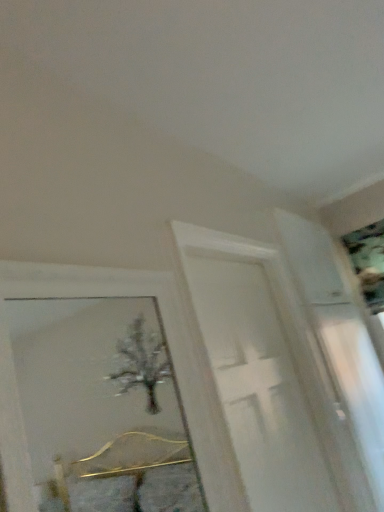
Question: Do you think white glossy screen door at center is within metallic silver picture frame at upper right, or outside of it?

Choices:
 (A) inside
 (B) outside

Answer: (B)

Question: Considering the positions of point (266, 440) and point (369, 240), is point (266, 440) closer or farther from the camera than point (369, 240)?

Choices:
 (A) closer
 (B) farther

Answer: (A)

Question: Based on their sizes in the image, would you say white glossy screen door at center is bigger or smaller than metallic silver picture frame at upper right?

Choices:
 (A) small
 (B) big

Answer: (B)

Question: Is metallic silver picture frame at upper right inside the boundaries of white glossy screen door at center, or outside?

Choices:
 (A) outside
 (B) inside

Answer: (A)

Question: From the image's perspective, is metallic silver picture frame at upper right positioned above or below white glossy screen door at center?

Choices:
 (A) above
 (B) below

Answer: (A)

Question: From a real-world perspective, is metallic silver picture frame at upper right physically located above or below white glossy screen door at center?

Choices:
 (A) above
 (B) below

Answer: (A)

Question: Considering the positions of metallic silver picture frame at upper right and white glossy screen door at center in the image, is metallic silver picture frame at upper right wider or thinner than white glossy screen door at center?

Choices:
 (A) wide
 (B) thin

Answer: (A)